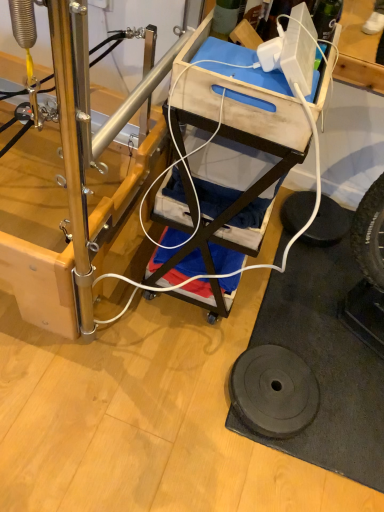
At what (x,y) coordinates should I click in order to perform the action: click on free space to the right of wooden cart at center. Please return your answer as a coordinate pair (x, y). Looking at the image, I should click on (293, 292).